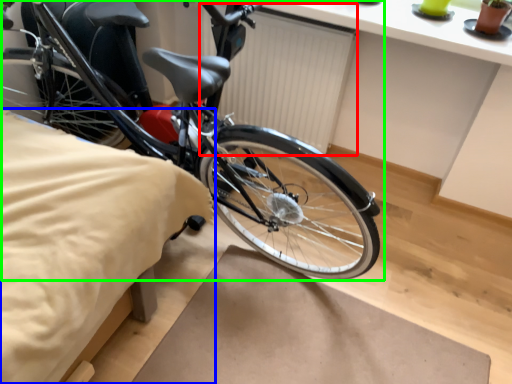
Question: Considering the real-world distances, which object is closest to radiator (highlighted by a red box)? sheet (highlighted by a blue box) or bicycle (highlighted by a green box).

Choices:
 (A) sheet
 (B) bicycle

Answer: (B)